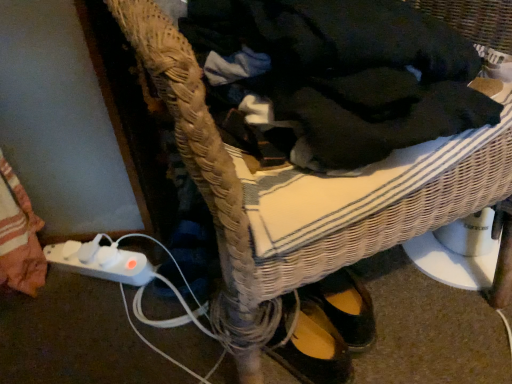
Question: In the image, is white plastic plug at lower left on the left side or the right side of dark woven fabric at center?

Choices:
 (A) right
 (B) left

Answer: (B)

Question: From their relative heights in the image, would you say white plastic plug at lower left is taller or shorter than dark woven fabric at center?

Choices:
 (A) short
 (B) tall

Answer: (A)

Question: Would you say white plastic plug at lower left is inside or outside dark woven fabric at center?

Choices:
 (A) outside
 (B) inside

Answer: (A)

Question: From a real-world perspective, is dark woven fabric at center positioned above or below white plastic plug at lower left?

Choices:
 (A) above
 (B) below

Answer: (A)

Question: Looking at their shapes, would you say dark woven fabric at center is wider or thinner than white plastic plug at lower left?

Choices:
 (A) thin
 (B) wide

Answer: (B)

Question: Would you say dark woven fabric at center is to the left or to the right of white plastic plug at lower left in the picture?

Choices:
 (A) right
 (B) left

Answer: (A)

Question: Is dark woven fabric at center taller or shorter than white plastic plug at lower left?

Choices:
 (A) tall
 (B) short

Answer: (A)